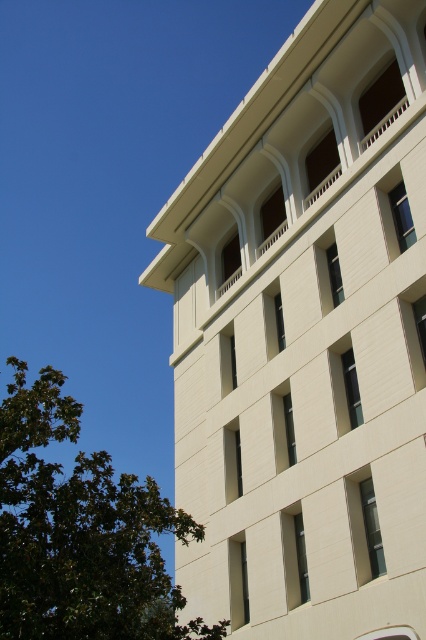
You are standing in front of the building and want to take a photo that includes both the white smooth building at upper center and the green leafy tree at lower left. Which object should you frame first in your camera viewfinder to ensure both are fully visible?

You should frame the green leafy tree at lower left first because the white smooth building at upper center is smaller in size compared to the green leafy tree at lower left, so starting with the larger object ensures there is enough space to include the smaller one as well.

Consider the image. You are standing in front of the building and looking up. Which object, the white smooth building at upper center or the green leafy tree at lower left, appears taller from your perspective?

The green leafy tree at lower left appears taller than the white smooth building at upper center from your perspective.

You are standing in front of the building and looking at the point with coordinates (307, 336). What part of the building does this point correspond to?

The point at coordinates (307, 336) is on the white smooth building at upper center.